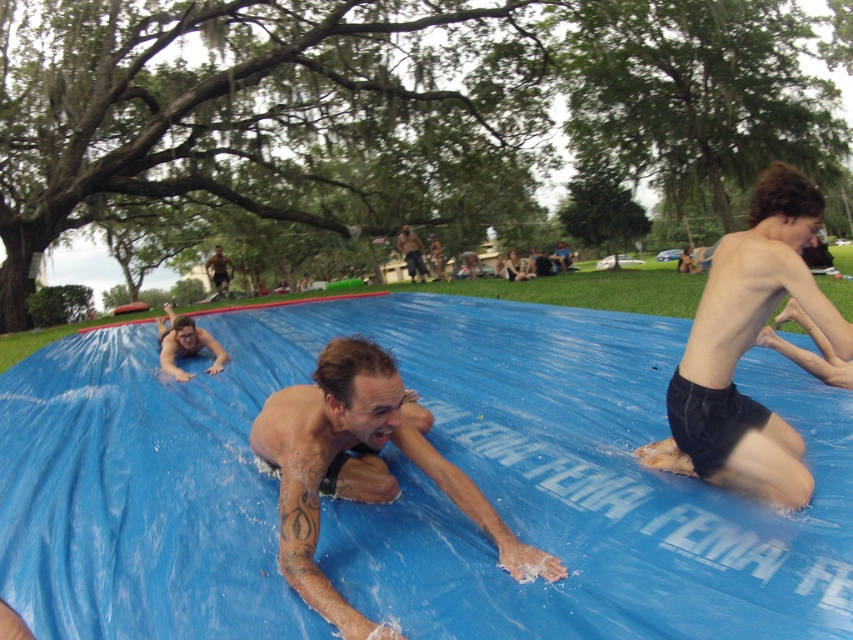
Question: Is brown leather jacket at upper center positioned at the back of dark brown hair at upper center?

Choices:
 (A) no
 (B) yes

Answer: (A)

Question: Does tattooed skin at center come behind brown leather jacket at upper center?

Choices:
 (A) no
 (B) yes

Answer: (A)

Question: Is blue rubber pool at center positioned at the back of brown leather jacket at upper center?

Choices:
 (A) yes
 (B) no

Answer: (B)

Question: Based on their relative distances, which object is farther from the tattooed skin at center?

Choices:
 (A) brown leather jacket at upper center
 (B) blue rubber pool at center
 (C) black matte shorts at center
 (D) dark brown hair at upper center

Answer: (D)

Question: Considering the real-world distances, which object is closest to the dark brown hair at upper center?

Choices:
 (A) brown leather jacket at upper center
 (B) black matte shorts at center
 (C) blue rubber pool at center

Answer: (A)

Question: Among these objects, which one is farthest from the camera?

Choices:
 (A) brown leather jacket at upper center
 (B) dark brown hair at upper center

Answer: (B)